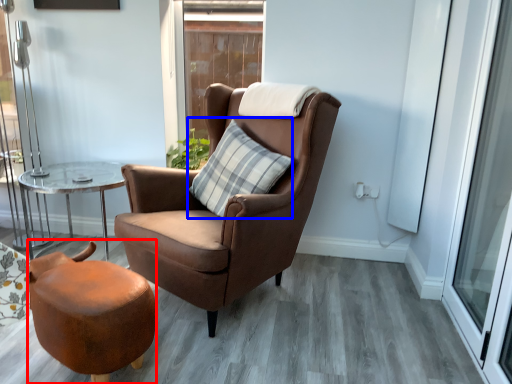
Question: Which object appears farthest to the camera in this image, stool (highlighted by a red box) or pillow (highlighted by a blue box)?

Choices:
 (A) stool
 (B) pillow

Answer: (B)